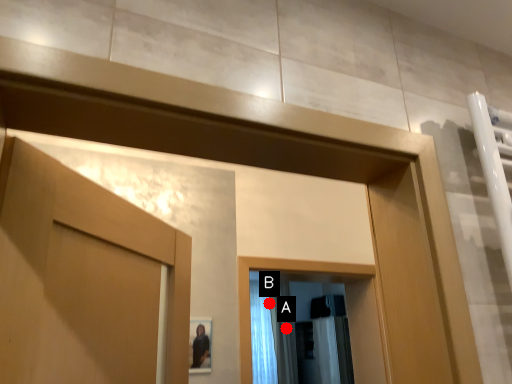
Question: Two points are circled on the image, labeled by A and B beside each circle. Which point is closer to the camera?

Choices:
 (A) A is closer
 (B) B is closer

Answer: (B)